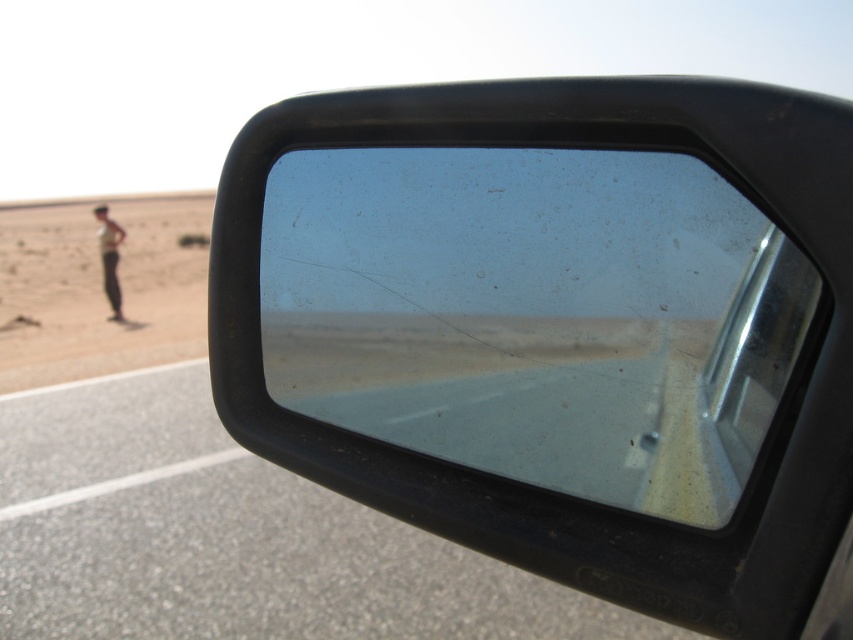
Question: Can you confirm if clear plastic mirror at center is positioned below desertdry sand at left?

Choices:
 (A) yes
 (B) no

Answer: (A)

Question: Which of the following is the closest to the observer?

Choices:
 (A) desertdry sand at left
 (B) clear plastic mirror at center
 (C) clear glass window at center

Answer: (C)

Question: Which of the following is the farthest from the observer?

Choices:
 (A) clear plastic mirror at center
 (B) light brown skin at lower left
 (C) desertdry sand at left

Answer: (B)

Question: Which object appears farthest from the camera in this image?

Choices:
 (A) desertdry sand at left
 (B) light brown skin at lower left

Answer: (B)

Question: Is desertdry sand at left above clear glass window at center?

Choices:
 (A) no
 (B) yes

Answer: (B)

Question: Does desertdry sand at left come in front of clear glass window at center?

Choices:
 (A) no
 (B) yes

Answer: (A)